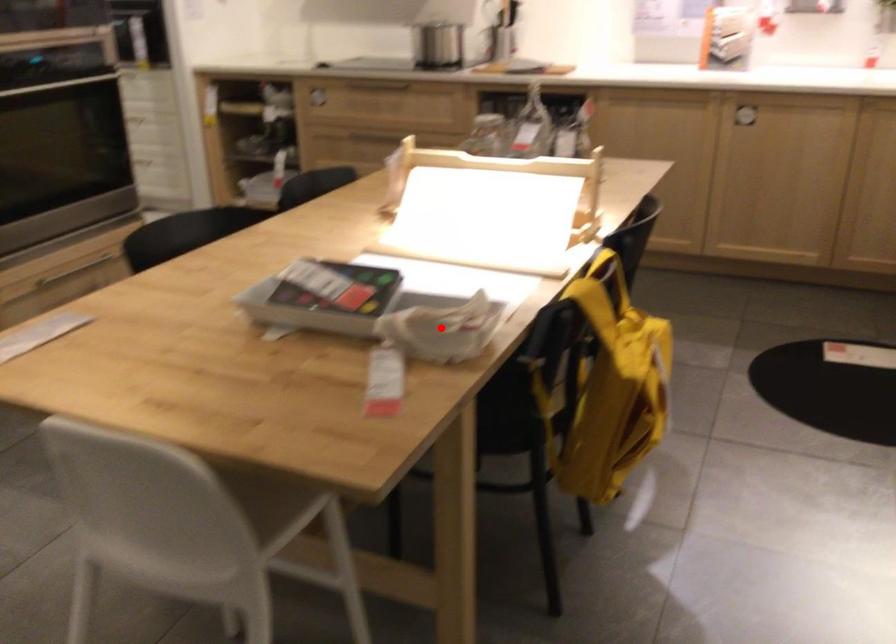
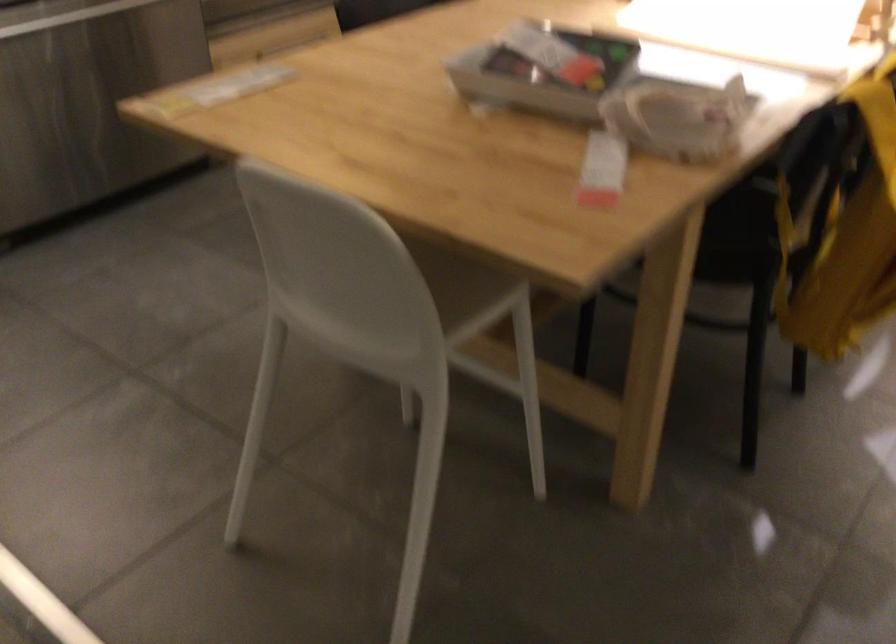
Find the pixel in the second image that matches the highlighted location in the first image.

(677, 117)